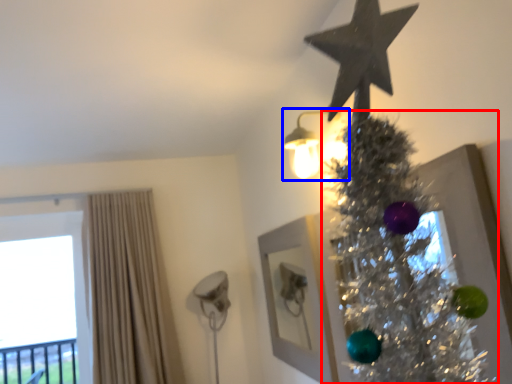
Question: Which point is closer to the camera, christmas tree (highlighted by a red box) or light fixture (highlighted by a blue box)?

Choices:
 (A) christmas tree
 (B) light fixture

Answer: (A)